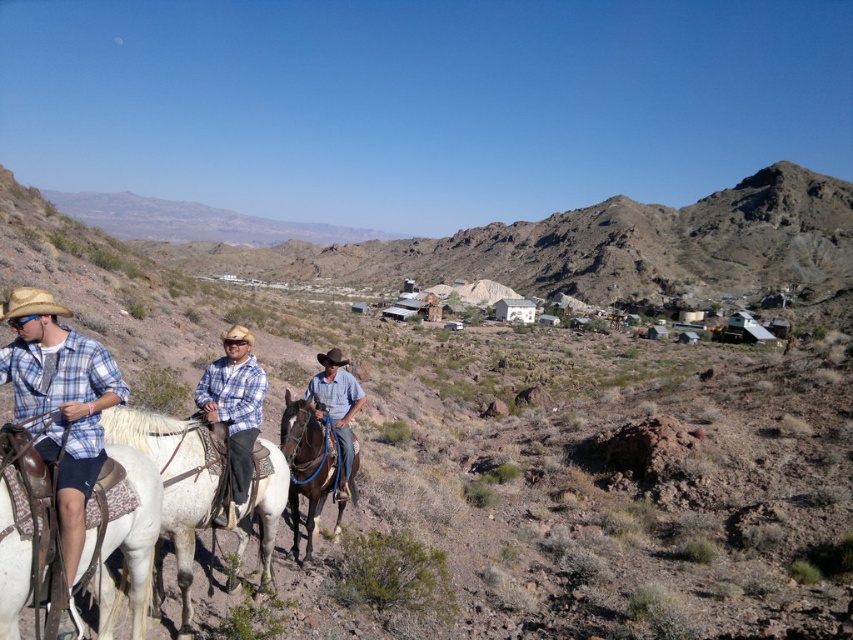
Question: Does white matte horse at left lie in front of denim shirt at center?

Choices:
 (A) no
 (B) yes

Answer: (B)

Question: Which point is farther to the camera?

Choices:
 (A) tan straw cowboy hat at left
 (B) brown felt cowboy hat at center
 (C) white leather boots at lower left

Answer: (B)

Question: Considering the real-world distances, which object is farthest from the brown glossy horse at center?

Choices:
 (A) denim shirt at center
 (B) tan straw cowboy hat at left
 (C) white matte horse at left

Answer: (B)

Question: Which point is closer to the camera?

Choices:
 (A) (228, 426)
 (B) (41, 310)

Answer: (B)

Question: Does white leather saddle at center have a smaller size compared to denim shirt at center?

Choices:
 (A) yes
 (B) no

Answer: (A)

Question: Can you confirm if white leather saddle at center is positioned below denim shirt at center?

Choices:
 (A) yes
 (B) no

Answer: (A)